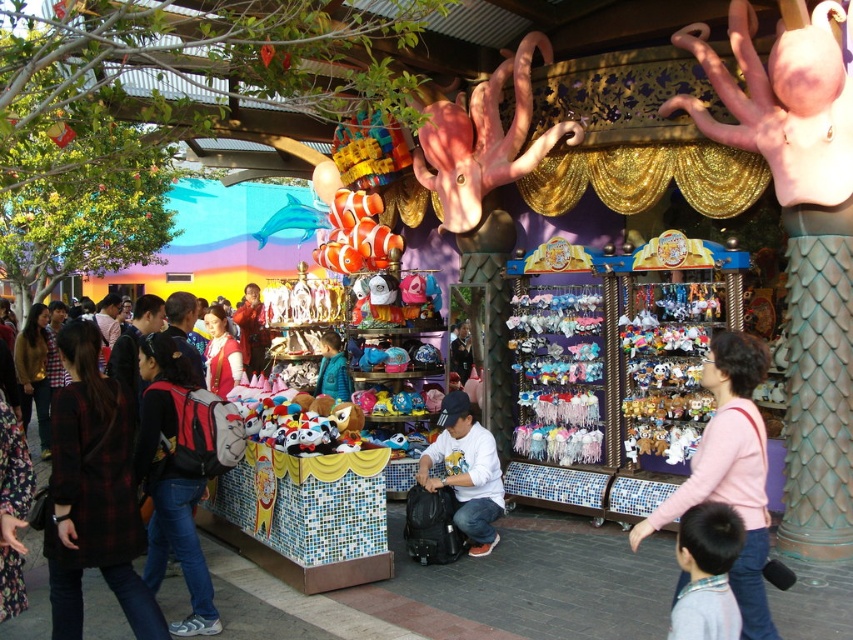
Question: Which point appears closest to the camera in this image?

Choices:
 (A) (717, 339)
 (B) (163, 332)
 (C) (473, 449)

Answer: (A)

Question: Where is black plaid coat at center left located in relation to red backpack at left in the image?

Choices:
 (A) below
 (B) above

Answer: (B)

Question: Is pink fabric shirt at center to the left of white matte shirt at center from the viewer's perspective?

Choices:
 (A) no
 (B) yes

Answer: (A)

Question: Among these objects, which one is farthest from the camera?

Choices:
 (A) pink fabric shirt at center
 (B) plaid fabric jacket at left
 (C) blue fuzzy jacket at center
 (D) light brown hair at lower right

Answer: (C)

Question: Which object is positioned farthest from the pink fabric shirt at center?

Choices:
 (A) blue fuzzy jacket at center
 (B) plaid fabric jacket at left
 (C) light brown hair at lower right

Answer: (A)

Question: Is plaid fabric jacket at left to the right of white matte shirt at center from the viewer's perspective?

Choices:
 (A) no
 (B) yes

Answer: (A)